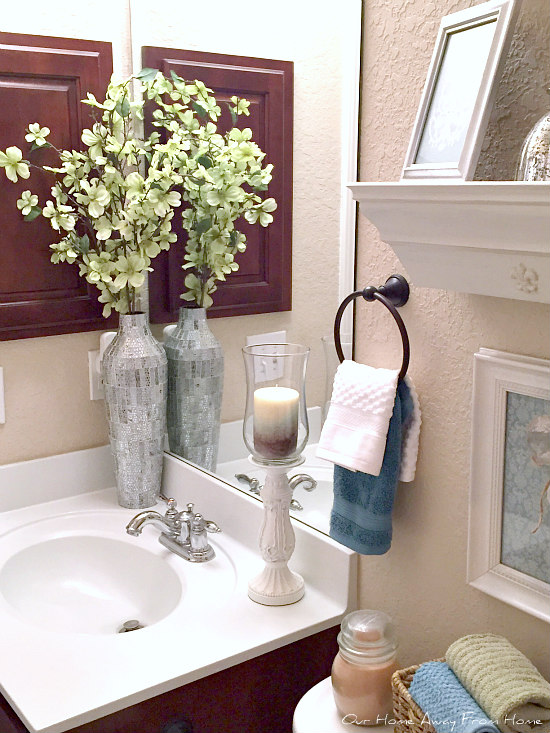
You are a GUI agent. You are given a task and a screenshot of the screen. Output one action in this format:
    pyautogui.click(x=<x>, y=<y>)
    Task: Click on the basket
    This screenshot has width=550, height=733.
    Given the screenshot: What is the action you would take?
    pyautogui.click(x=397, y=709)